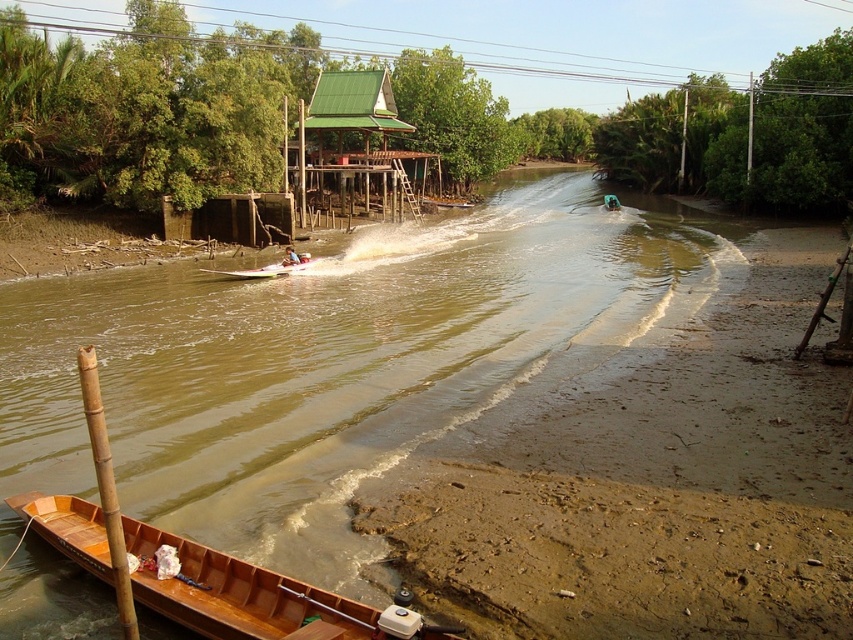
You are a tourist standing on the riverbank observing the brown wooden river at center and the wooden boat at lower left. Which object takes up more space in the scene?

The brown wooden river at center takes up more space in the scene as it is larger in size than the wooden boat at lower left.

You are standing on the riverbank and notice the brown wooden river at center and the light blue fabric shirt at center. Which object is wider when viewed from above?

The brown wooden river at center is wider than the light blue fabric shirt at center.